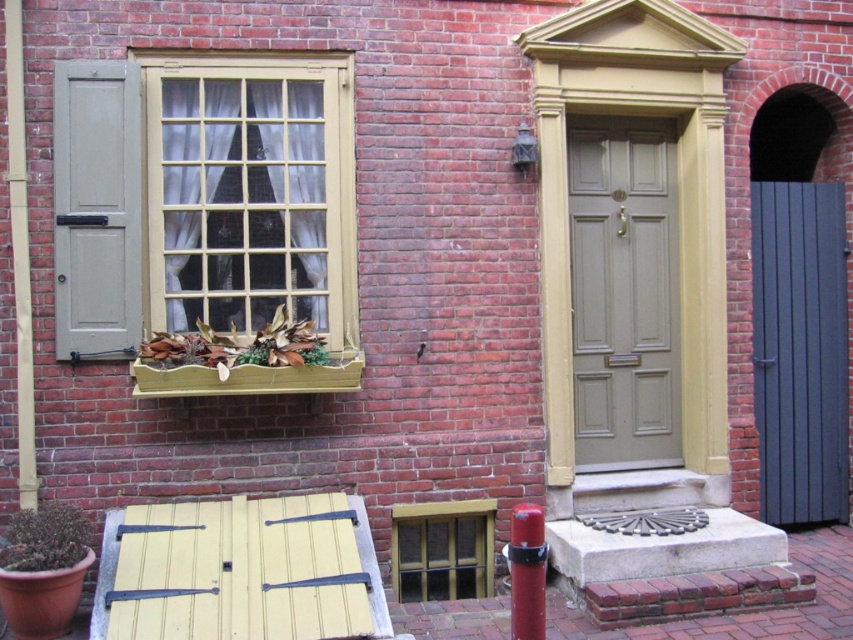
Question: Can you confirm if wooden at lower center is thinner than brown leafy plant at lower left?

Choices:
 (A) yes
 (B) no

Answer: (B)

Question: Is green matte plant at lower left thinner than brown leafy plant at lower left?

Choices:
 (A) yes
 (B) no

Answer: (A)

Question: Among these objects, which one is farthest from the camera?

Choices:
 (A) wooden at lower center
 (B) green matte plant at lower left
 (C) wooden window at center

Answer: (C)

Question: Which object is farther from the camera taking this photo?

Choices:
 (A) wooden window at center
 (B) brown leafy plant at window
 (C) brown leafy plant at lower left

Answer: (A)

Question: Can you confirm if green matte plant at lower left is positioned to the left of brown leafy plant at lower left?

Choices:
 (A) yes
 (B) no

Answer: (A)

Question: Which point appears closest to the camera in this image?

Choices:
 (A) (538, 563)
 (B) (68, 90)

Answer: (A)